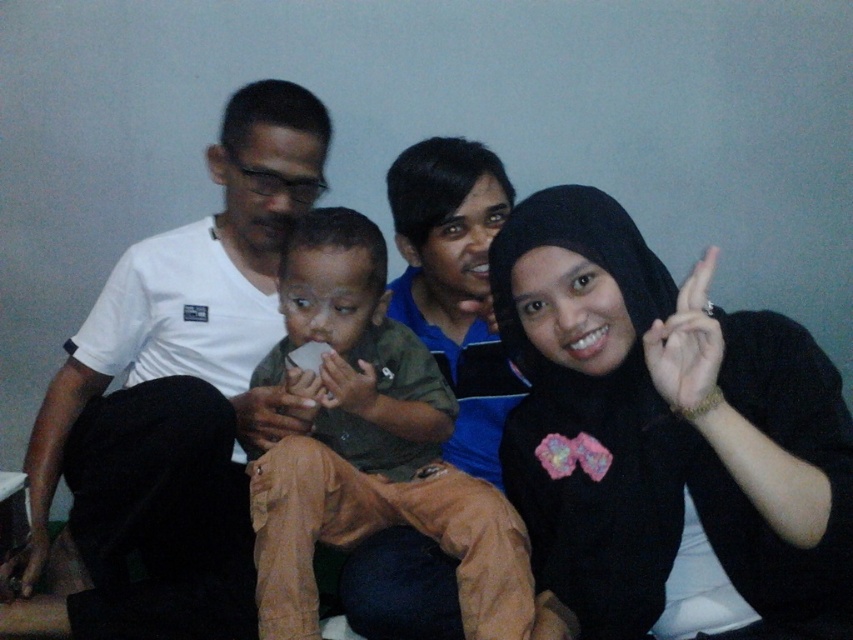
Based on the photo, does black matte hijab at right appear under white matte t-shirt at left?

Yes, black matte hijab at right is below white matte t-shirt at left.

Between point (543, 561) and point (209, 262), which one is positioned in front?

Point (543, 561) is in front.

Locate an element on the screen. Image resolution: width=853 pixels, height=640 pixels. black matte hijab at right is located at coordinates (664, 429).

Is white matte t-shirt at left thinner than brown cotton shirt at center?

In fact, white matte t-shirt at left might be wider than brown cotton shirt at center.

Is white matte t-shirt at left above brown cotton shirt at center?

Correct, white matte t-shirt at left is located above brown cotton shirt at center.

Based on the photo, who is more distant from viewer, (160, 486) or (289, 260)?

The point (160, 486) is behind.

At what (x,y) coordinates should I click in order to perform the action: click on white matte t-shirt at left. Please return your answer as a coordinate pair (x, y). This screenshot has height=640, width=853. Looking at the image, I should click on (173, 403).

Does black matte hijab at right lie in front of brown cotton shirt at center?

Yes, black matte hijab at right is closer to the viewer.

Between point (776, 440) and point (341, 259), which one is positioned behind?

Point (341, 259)

Locate an element on the screen. black matte hijab at right is located at coordinates (664, 429).